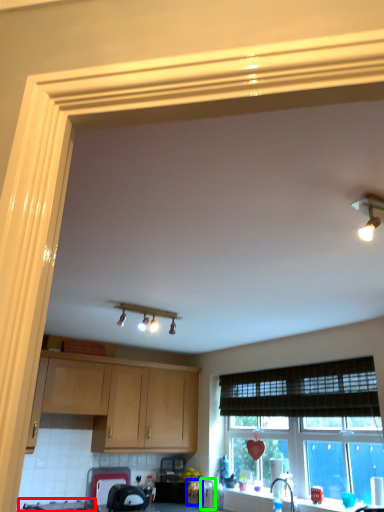
Question: Estimate the real-world distances between objects in this image. Which object is closer to gas stove (highlighted by a red box), appliance (highlighted by a blue box) or appliance (highlighted by a green box)?

Choices:
 (A) appliance
 (B) appliance

Answer: (A)